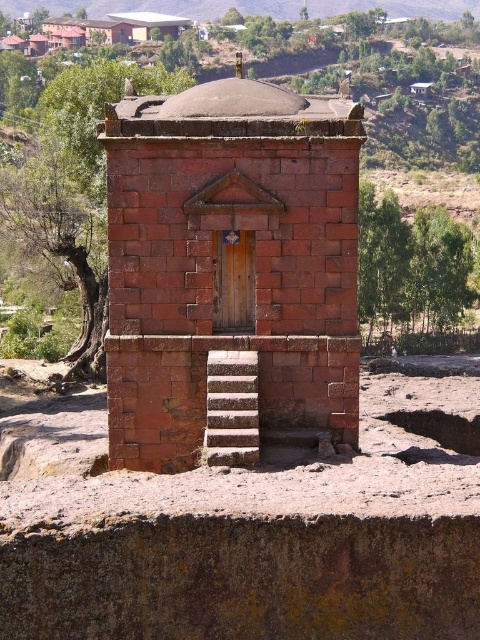
Who is more distant from viewer, (x=171, y=12) or (x=239, y=406)?

Point (x=171, y=12)

Locate an element on the screen. This screenshot has width=480, height=640. red brick wall at upper center is located at coordinates (250, 8).

Does red brick chapel at center have a lesser height compared to red brick wall at upper center?

No, red brick chapel at center is not shorter than red brick wall at upper center.

At what (x,y) coordinates should I click in order to perform the action: click on red brick chapel at center. Please return your answer as a coordinate pair (x, y). This screenshot has height=640, width=480. Looking at the image, I should click on (229, 272).

Does red brick chapel at center come in front of white stone stairs at center?

No, red brick chapel at center is behind white stone stairs at center.

Is point (325, 193) positioned after point (241, 406)?

Yes.

What do you see at coordinates (229, 272) in the screenshot?
I see `red brick chapel at center` at bounding box center [229, 272].

Find the location of a particular element. red brick chapel at center is located at coordinates (229, 272).